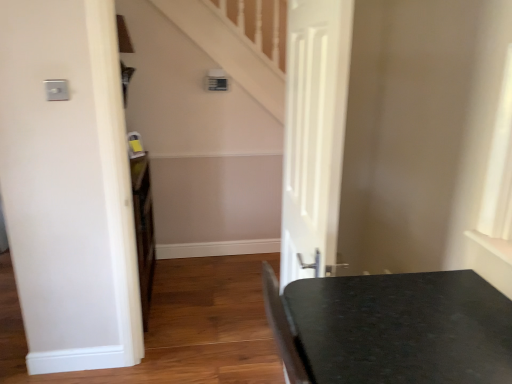
What do you see at coordinates (314, 133) in the screenshot? I see `white matte door at center` at bounding box center [314, 133].

You are a GUI agent. You are given a task and a screenshot of the screen. Output one action in this format:
    pyautogui.click(x=<x>, y=<y>)
    Task: Click on the white matte door at center
    This screenshot has height=384, width=512.
    Given the screenshot: What is the action you would take?
    pyautogui.click(x=314, y=133)

What is the approximate height of white matte door at center?

It is 1.76 meters.

The height and width of the screenshot is (384, 512). I want to click on black granite table at lower right, so click(392, 328).

What do you see at coordinates (392, 328) in the screenshot? I see `black granite table at lower right` at bounding box center [392, 328].

This screenshot has height=384, width=512. In order to click on white matte door at center in this screenshot , I will do `click(314, 133)`.

Which object is positioned more to the left, black granite table at lower right or white matte door at center?

Positioned to the left is white matte door at center.

Does black granite table at lower right lie in front of white matte door at center?

That is True.

Which is in front, point (505, 342) or point (294, 17)?

The point (505, 342) is closer to the camera.

From the image's perspective, is black granite table at lower right above or below white matte door at center?

Clearly, from the image's perspective, black granite table at lower right is below white matte door at center.

From a real-world perspective, is black granite table at lower right on top of white matte door at center?

Indeed, from a real-world perspective, black granite table at lower right stands above white matte door at center.

Considering the sizes of black granite table at lower right and white matte door at center in the image, is black granite table at lower right wider or thinner than white matte door at center?

In the image, black granite table at lower right appears to be wider than white matte door at center.

Considering the relative sizes of black granite table at lower right and white matte door at center in the image provided, is black granite table at lower right taller than white matte door at center?

No, black granite table at lower right is not taller than white matte door at center.

Is black granite table at lower right smaller than white matte door at center?

Actually, black granite table at lower right might be larger than white matte door at center.

Is black granite table at lower right completely or partially outside of white matte door at center?

Yes, black granite table at lower right is located beyond the bounds of white matte door at center.

Are black granite table at lower right and white matte door at center making contact?

No, black granite table at lower right is not beside white matte door at center.

Is black granite table at lower right looking in the opposite direction of white matte door at center?

No.

Locate an element on the screen. table on the right of white matte door at center is located at coordinates (392, 328).

Between white matte door at center and black granite table at lower right, which one appears on the left side from the viewer's perspective?

white matte door at center.

Is white matte door at center in front of or behind black granite table at lower right in the image?

Clearly, white matte door at center is behind black granite table at lower right.

Is point (350, 37) closer to viewer compared to point (287, 287)?

Yes, it is in front of point (287, 287).

From the image's perspective, between white matte door at center and black granite table at lower right, which one is located above?

white matte door at center is shown above in the image.

From a real-world perspective, does white matte door at center stand above black granite table at lower right?

No, from a real-world perspective, white matte door at center is not over black granite table at lower right

Which object is wider, white matte door at center or black granite table at lower right?

black granite table at lower right.

From the picture: Between white matte door at center and black granite table at lower right, which one has more height?

Standing taller between the two is white matte door at center.

Looking at the image, does white matte door at center seem bigger or smaller compared to black granite table at lower right?

white matte door at center is smaller than black granite table at lower right.

Do you think white matte door at center is within black granite table at lower right, or outside of it?

white matte door at center exists outside the volume of black granite table at lower right.

Is white matte door at center in contact with black granite table at lower right?

white matte door at center and black granite table at lower right are clearly separated.

Does white matte door at center turn towards black granite table at lower right?

No, white matte door at center is not oriented towards black granite table at lower right.

Find the location of a particular element. The image size is (512, 384). table in front of the white matte door at center is located at coordinates (392, 328).

What are the coordinates of `door lying on the left of black granite table at lower right` in the screenshot? It's located at (314, 133).

Image resolution: width=512 pixels, height=384 pixels. There is a white matte door at center. What are the coordinates of `table above it (from a real-world perspective)` in the screenshot? It's located at (392, 328).